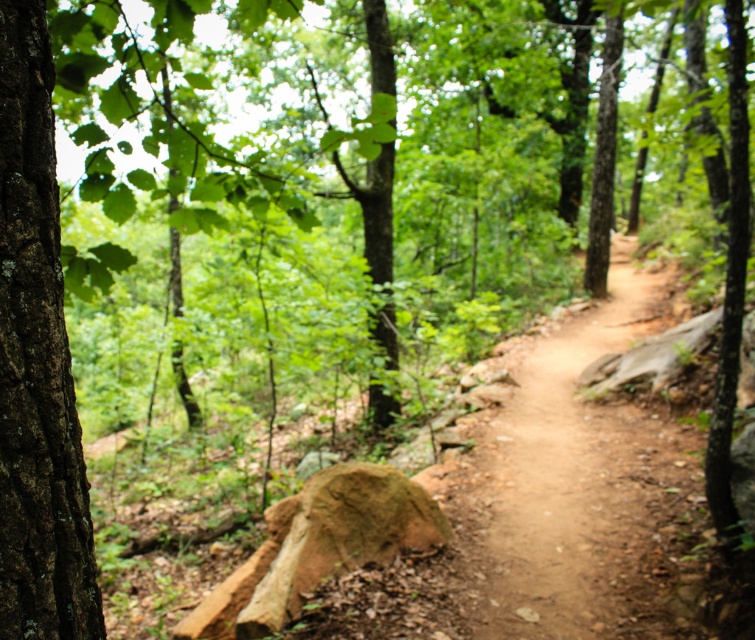
From the picture: You are a hiker planning to cross the dirt path at center. You notice a brown rough bark tree at left nearby. Considering their heights, which one is taller?

The dirt path at center has a greater height compared to the brown rough bark tree at left, so the dirt path at center is taller.

You are a hiker trying to follow the dirt path at center. You notice a brown rough bark tree at left nearby. Which direction should you turn to stay on the path?

To stay on the dirt path at center, you should turn to the right away from the brown rough bark tree at left, since the dirt path at center is located to the right of the tree.